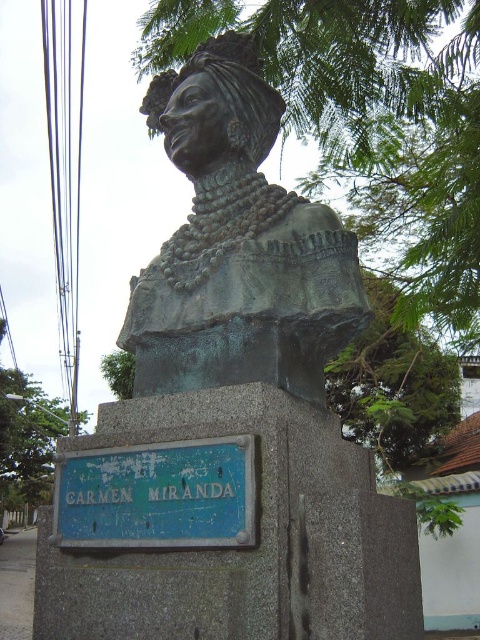
Is bronze bust at center closer to camera compared to green leafy tree at lower left?

That is True.

Can you confirm if bronze bust at center is taller than green leafy tree at lower left?

Yes.

At what (x,y) coordinates should I click in order to perform the action: click on bronze bust at center. Please return your answer as a coordinate pair (x, y). Looking at the image, I should click on 238,244.

Between green leafy tree at left and green leafy tree at lower left, which one appears on the left side from the viewer's perspective?

green leafy tree at left

Who is more forward, (22, 397) or (121, 365)?

Point (121, 365) is in front.

The height and width of the screenshot is (640, 480). I want to click on green leafy tree at left, so click(x=26, y=438).

Is bronze bust at center positioned behind blue painted metal sign at lower center?

Yes, it is.

Who is more distant from viewer, (146, 269) or (245, 465)?

Positioned behind is point (146, 269).

You are a GUI agent. You are given a task and a screenshot of the screen. Output one action in this format:
    pyautogui.click(x=<x>, y=<y>)
    Task: Click on the bronze bust at center
    The height and width of the screenshot is (640, 480).
    Given the screenshot: What is the action you would take?
    pyautogui.click(x=238, y=244)